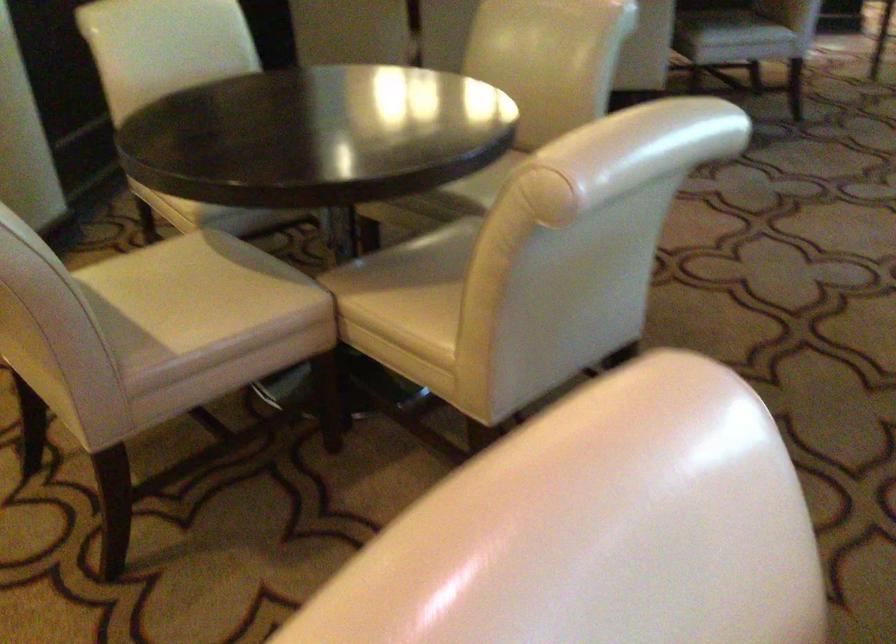
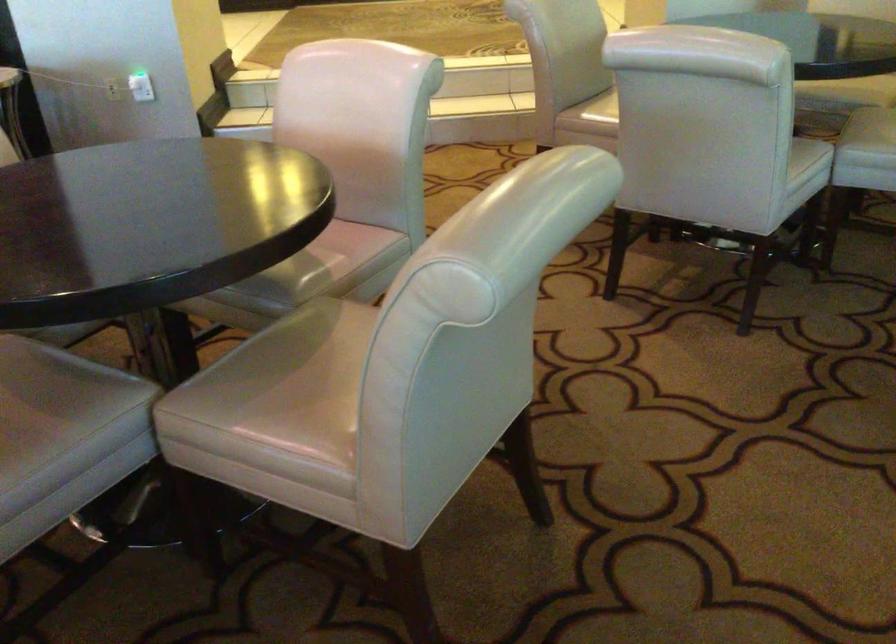
Where in the second image is the point corresponding to point 462,185 from the first image?

(874, 125)